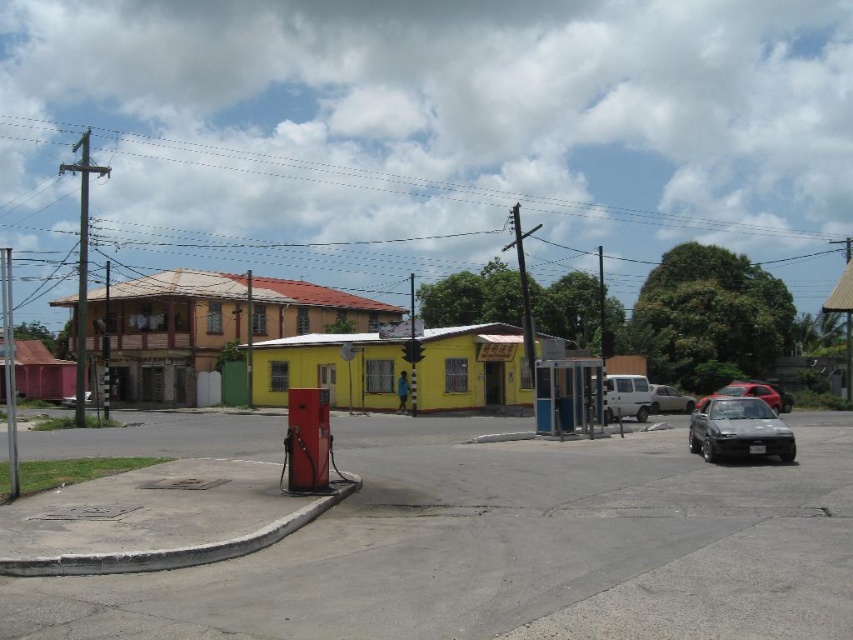
How far apart are metallic silver car at center and metallic silver car at lower left?

28.55 meters

Who is positioned more to the left, metallic silver car at center or metallic silver car at lower left?

metallic silver car at lower left

Which is behind, point (651, 412) or point (86, 394)?

The point (86, 394) is behind.

Identify the location of metallic silver car at center. (669, 400).

Consider the image. Is shiny black car at right positioned before metallic silver car at right?

Yes.

How far apart are shiny black car at right and metallic silver car at right?

They are 9.03 meters apart.

Is point (772, 410) farther from viewer compared to point (773, 397)?

No, (772, 410) is in front of (773, 397).

Find the location of a particular element. The width and height of the screenshot is (853, 640). shiny black car at right is located at coordinates (738, 429).

Who is shorter, metallic silver car at right or metallic silver car at lower left?

metallic silver car at lower left is shorter.

Does metallic silver car at right have a lesser width compared to metallic silver car at lower left?

No.

Find the location of `metallic silver car at right`. metallic silver car at right is located at coordinates (747, 394).

What are the coordinates of `metallic silver car at right` in the screenshot? It's located at (747, 394).